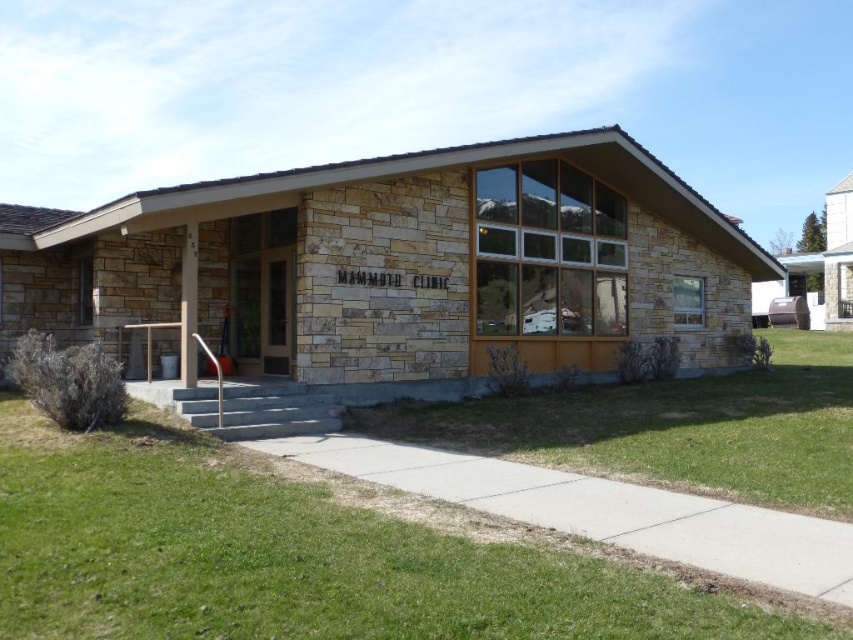
You are standing at the entrance of the MAMMOTH CLINIC and notice two areas of green grass at lower left and green grass at lower center. Which area of grass is larger?

The green grass at lower center is larger than the green grass at lower left.